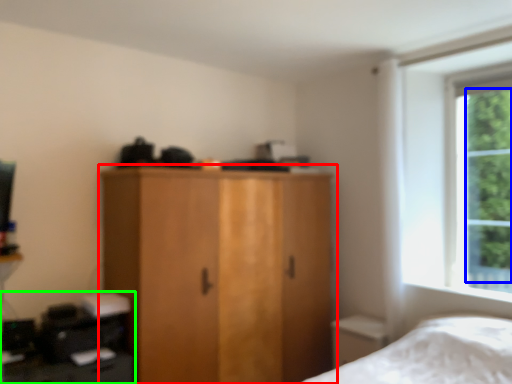
Question: Estimate the real-world distances between objects in this image. Which object is farther from cupboard (highlighted by a red box), tree (highlighted by a blue box) or computer desk (highlighted by a green box)?

Choices:
 (A) tree
 (B) computer desk

Answer: (A)